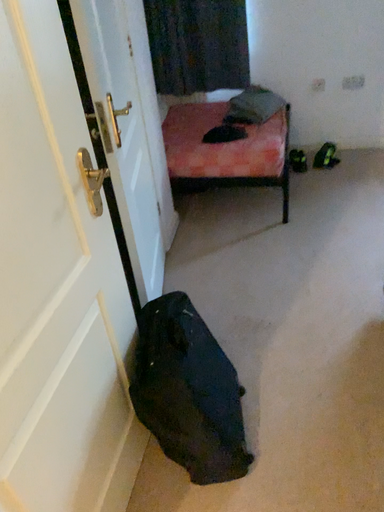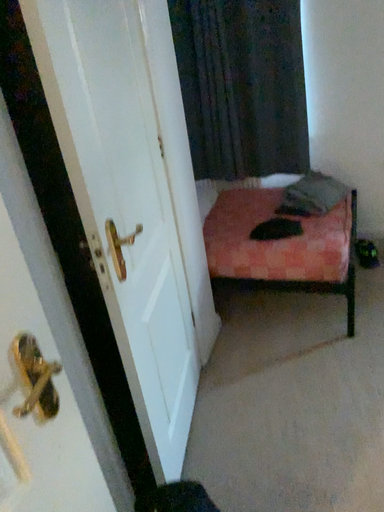
Question: Which way did the camera rotate in the video?

Choices:
 (A) rotated downward
 (B) rotated upward

Answer: (B)